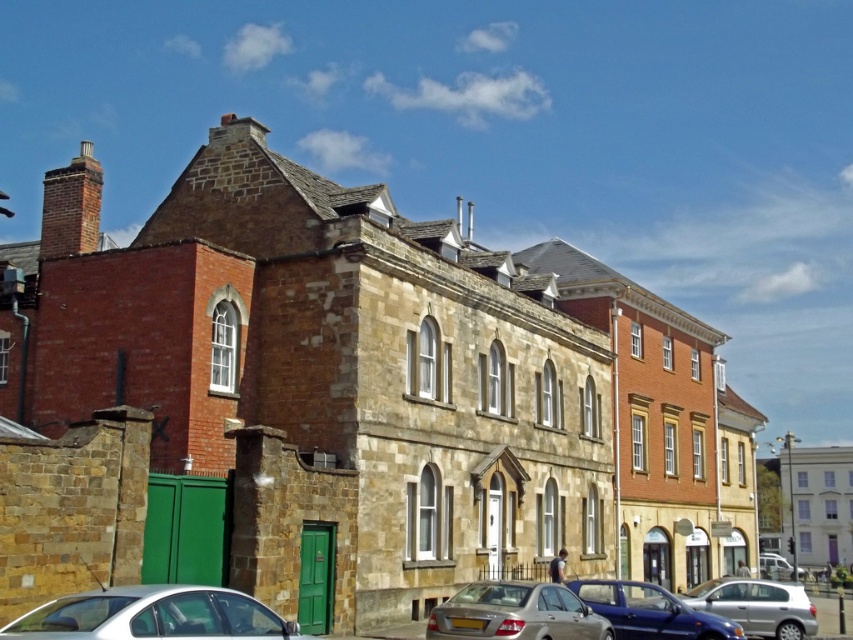
Question: Estimate the real-world distances between objects in this image. Which object is closer to the silver metallic hatchback at lower right?

Choices:
 (A) silver metallic car at lower left
 (B) silver metallic van at lower right
 (C) blue metallic car at center

Answer: (C)

Question: Does silver metallic car at lower left have a lesser width compared to silver metallic hatchback at lower right?

Choices:
 (A) no
 (B) yes

Answer: (B)

Question: Does blue metallic car at center appear under silver metallic hatchback at lower right?

Choices:
 (A) yes
 (B) no

Answer: (B)

Question: Which object appears farthest from the camera in this image?

Choices:
 (A) silver metallic van at lower right
 (B) silver metallic car at lower left
 (C) satin silver sedan at lower center
 (D) blue metallic car at center

Answer: (A)

Question: Which is farther from the satin silver sedan at lower center?

Choices:
 (A) silver metallic hatchback at lower right
 (B) silver metallic van at lower right
 (C) silver metallic car at lower left
 (D) blue metallic car at center

Answer: (B)

Question: Is silver metallic car at lower left closer to the viewer compared to silver metallic hatchback at lower right?

Choices:
 (A) yes
 (B) no

Answer: (A)